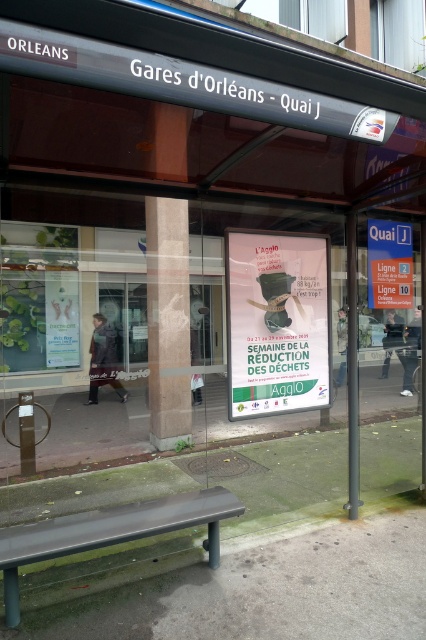
Which of these two, black plastic bench at lower center or white paper sign at center, stands shorter?

With less height is black plastic bench at lower center.

Can you confirm if black plastic bench at lower center is wider than white paper sign at center?

Yes, black plastic bench at lower center is wider than white paper sign at center.

Find the location of a particular element. The height and width of the screenshot is (640, 426). black plastic bench at lower center is located at coordinates (109, 532).

Does white paper poster at center appear over black plastic bench at lower center?

Indeed, white paper poster at center is positioned over black plastic bench at lower center.

Can you confirm if white paper poster at center is taller than black plastic bench at lower center?

Yes.

Which is behind, point (285, 246) or point (14, 561)?

Positioned behind is point (285, 246).

Where is `white paper poster at center`? The width and height of the screenshot is (426, 640). white paper poster at center is located at coordinates (276, 323).

Which is more to the left, white paper poster at center or white paper sign at center?

white paper poster at center is more to the left.

Does point (235, 310) come in front of point (394, 234)?

Yes, point (235, 310) is closer to viewer.

At what (x,y) coordinates should I click in order to perform the action: click on white paper poster at center. Please return your answer as a coordinate pair (x, y). Looking at the image, I should click on 276,323.